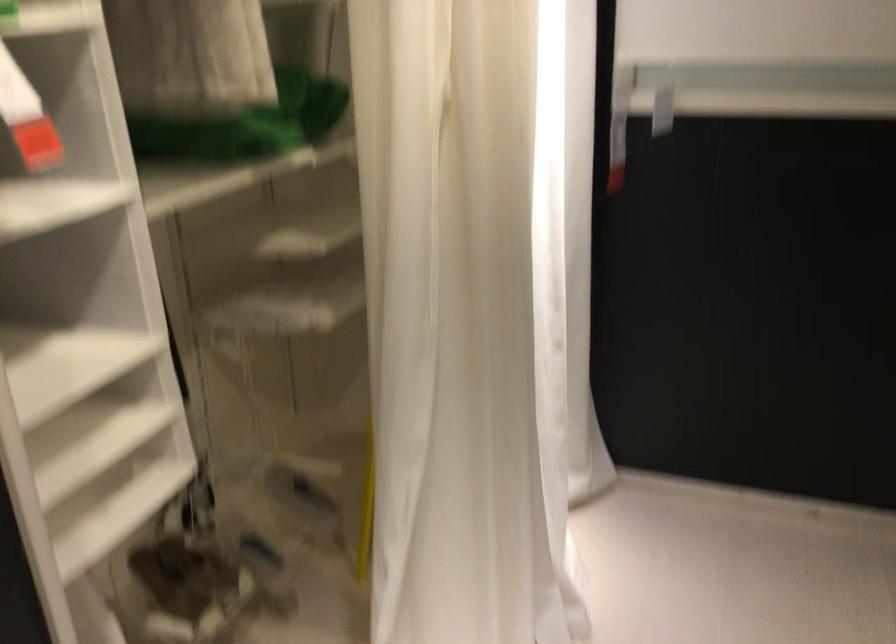
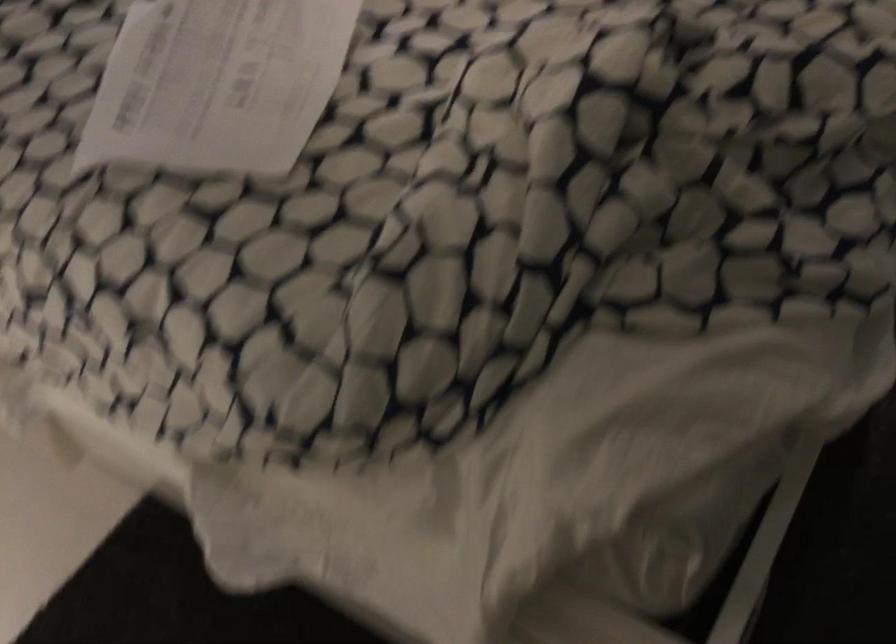
Based on the continuous images, in which direction is the camera rotating?

The camera's rotation is toward right-down.